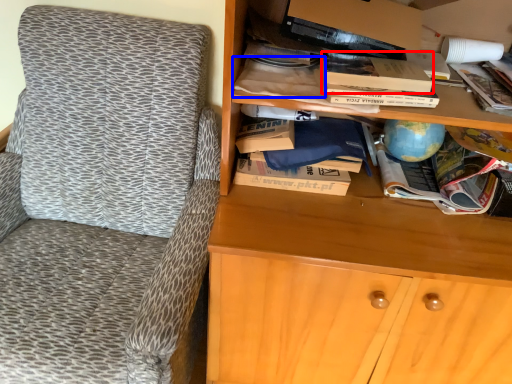
Question: Which object appears closest to the camera in this image, paperback book (highlighted by a red box) or book (highlighted by a blue box)?

Choices:
 (A) paperback book
 (B) book

Answer: (A)